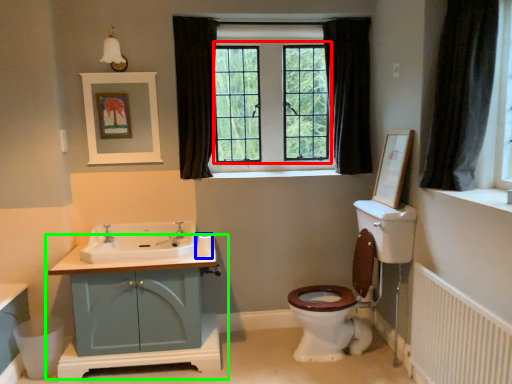
Question: Based on their relative distances, which object is nearer to bay window (highlighted by a red box)? Choose from toilet paper (highlighted by a blue box) and bathroom cabinet (highlighted by a green box).

Choices:
 (A) toilet paper
 (B) bathroom cabinet

Answer: (A)